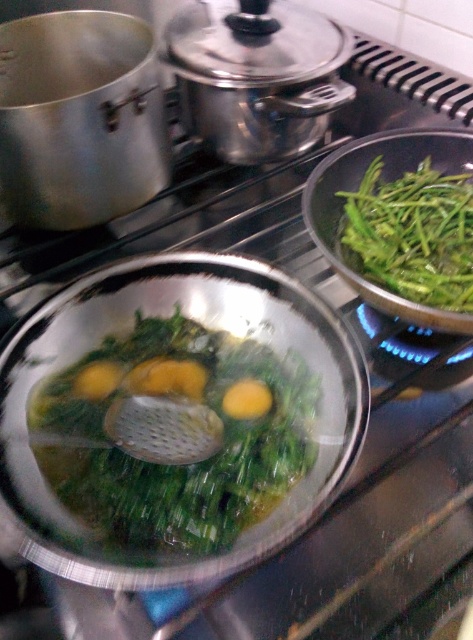
Is point (171, 477) in front of point (361, 189)?

Yes.

Is green leafy vegetables at center positioned at the back of green leafy vegetable at right?

No, it is not.

Which is behind, point (234, 541) or point (437, 195)?

Point (437, 195)

Locate an element on the screen. green leafy vegetables at center is located at coordinates (166, 458).